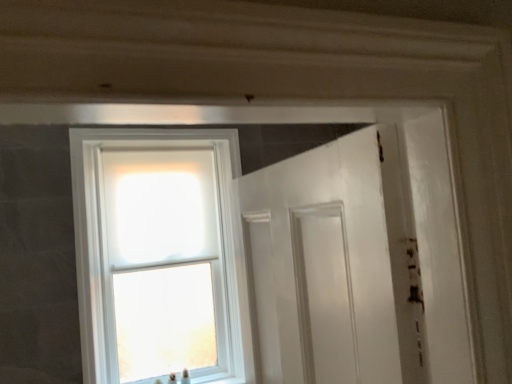
Question: From the image's perspective, is white glossy door at center located above or below clear glass window at upper left?

Choices:
 (A) above
 (B) below

Answer: (B)

Question: Is point (321, 306) positioned closer to the camera than point (96, 142)?

Choices:
 (A) closer
 (B) farther

Answer: (A)

Question: Considering the positions of white glossy door at center and clear glass window at upper left in the image, is white glossy door at center wider or thinner than clear glass window at upper left?

Choices:
 (A) wide
 (B) thin

Answer: (B)

Question: Visually, is clear glass window at upper left positioned to the left or to the right of white glossy door at center?

Choices:
 (A) right
 (B) left

Answer: (B)

Question: From a real-world perspective, is clear glass window at upper left above or below white glossy door at center?

Choices:
 (A) below
 (B) above

Answer: (B)

Question: From the image's perspective, relative to white glossy door at center, is clear glass window at upper left above or below?

Choices:
 (A) below
 (B) above

Answer: (B)

Question: Is clear glass window at upper left bigger or smaller than white glossy door at center?

Choices:
 (A) small
 (B) big

Answer: (B)